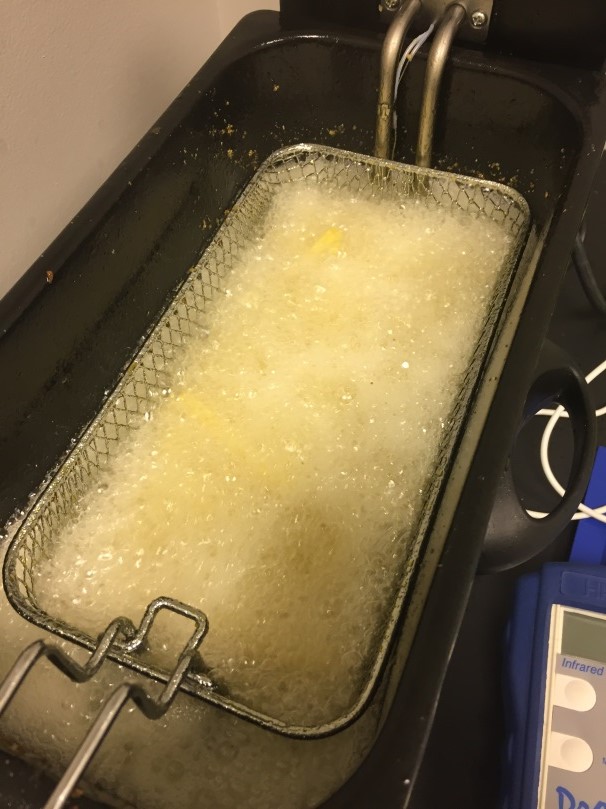
You are a GUI agent. You are given a task and a screenshot of the screen. Output one action in this format:
    pyautogui.click(x=<x>, y=<y>)
    Task: Click on the metal piping
    
    Given the screenshot: What is the action you would take?
    [395, 66], [447, 44]